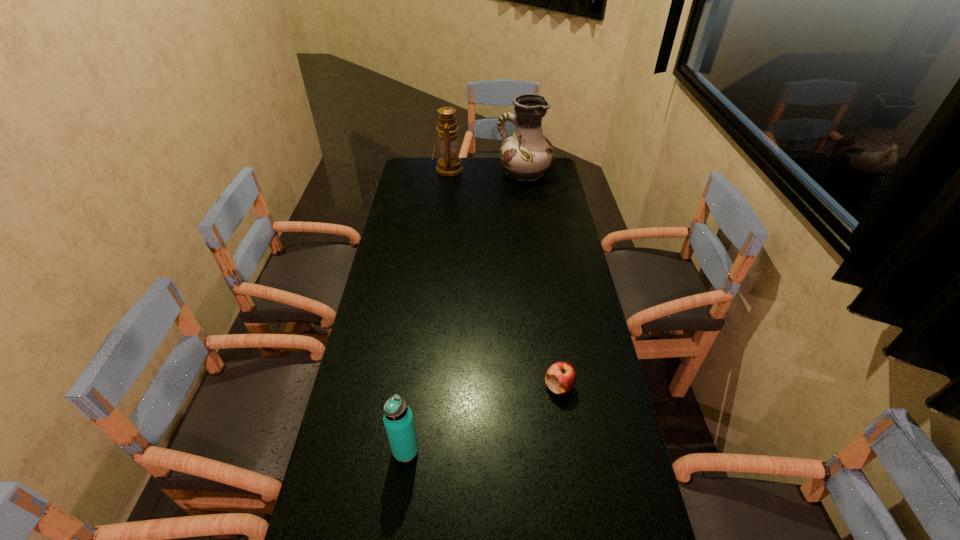
This screenshot has width=960, height=540. Find the location of `vase present at the far edge`. vase present at the far edge is located at coordinates (527, 154).

You are a GUI agent. You are given a task and a screenshot of the screen. Output one action in this format:
    pyautogui.click(x=<x>, y=<y>)
    Task: Click on the oil lamp present at the far edge
    This screenshot has width=960, height=540.
    Given the screenshot: What is the action you would take?
    pyautogui.click(x=450, y=164)

You are a GUI agent. You are given a task and a screenshot of the screen. Output one action in this format:
    pyautogui.click(x=<x>, y=<y>)
    Task: Click on the oil lamp located at the left edge
    
    Given the screenshot: What is the action you would take?
    pyautogui.click(x=450, y=164)

This screenshot has height=540, width=960. Identify the location of water bottle that is at the left edge. (398, 419).

Find the location of a particular element. The width and height of the screenshot is (960, 540). vase that is at the right edge is located at coordinates (527, 154).

This screenshot has width=960, height=540. What are the coordinates of `apple located at the right edge` in the screenshot? It's located at (560, 377).

I want to click on object at the far left corner, so click(x=450, y=164).

I want to click on object at the far right corner, so click(x=527, y=154).

In the image, there is a desktop. Identify the location of vacant region at the left edge. The image size is (960, 540). (400, 316).

Locate an element on the screen. The height and width of the screenshot is (540, 960). free space at the right edge of the desktop is located at coordinates (572, 244).